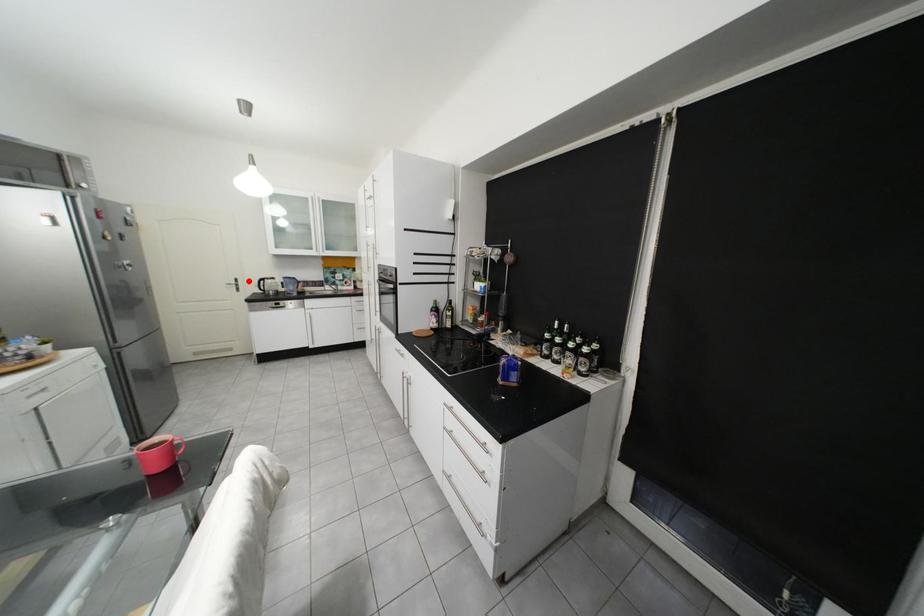
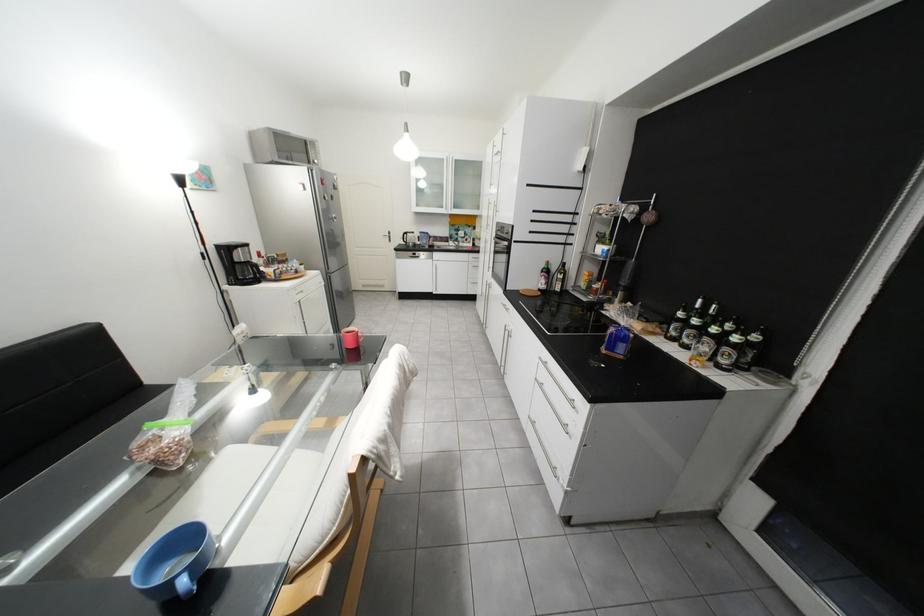
Question: I am providing you with two images of the same scene from different viewpoints. In image1, a red point is highlighted. Considering the same 3D point in image2, which of the following is correct?

Choices:
 (A) It is closer
 (B) It is farther

Answer: (A)